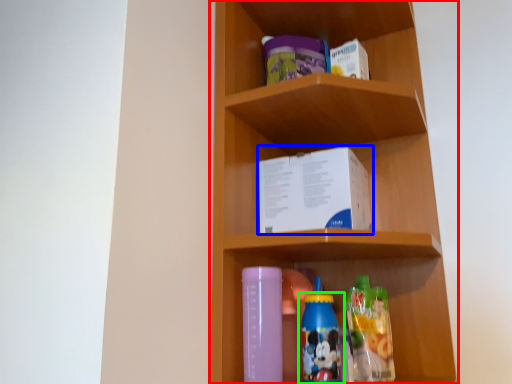
Question: Based on their relative distances, which object is farther from shelf (highlighted by a red box)? Choose from book (highlighted by a blue box) and bottle (highlighted by a green box).

Choices:
 (A) book
 (B) bottle

Answer: (B)